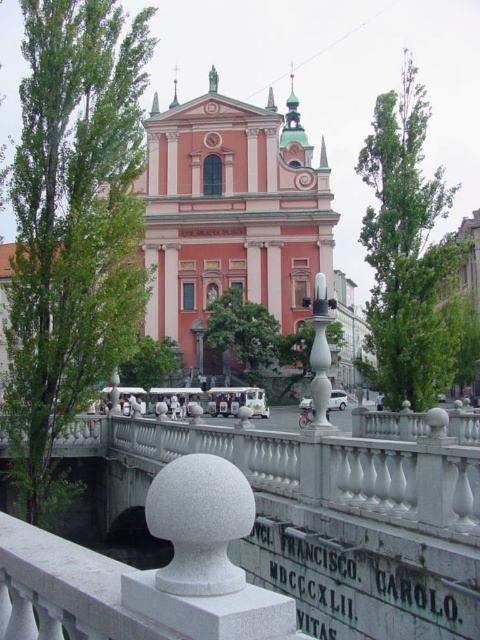
Question: Which point is closer to the camera?

Choices:
 (A) white glossy car at center
 (B) white stone balustrade at center
 (C) matte pink building at center

Answer: (B)

Question: Which of the following is the closest to the observer?

Choices:
 (A) (328, 403)
 (B) (106, 420)
 (C) (271, 304)
 (D) (223, 401)

Answer: (A)

Question: Can you confirm if white stone balustrade at center is wider than metallic silver car at center?

Choices:
 (A) no
 (B) yes

Answer: (B)

Question: Is white stone balustrade at center wider than white glossy car at center?

Choices:
 (A) no
 (B) yes

Answer: (B)

Question: Does matte pink building at center appear on the left side of white glossy car at center?

Choices:
 (A) yes
 (B) no

Answer: (A)

Question: Among these objects, which one is nearest to the camera?

Choices:
 (A) metallic silver car at center
 (B) white glossy car at center

Answer: (B)